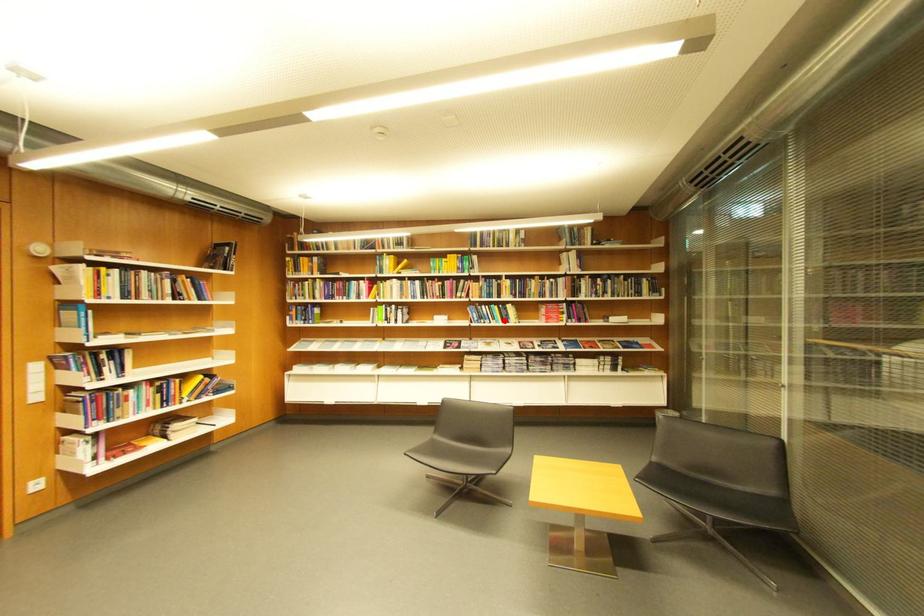
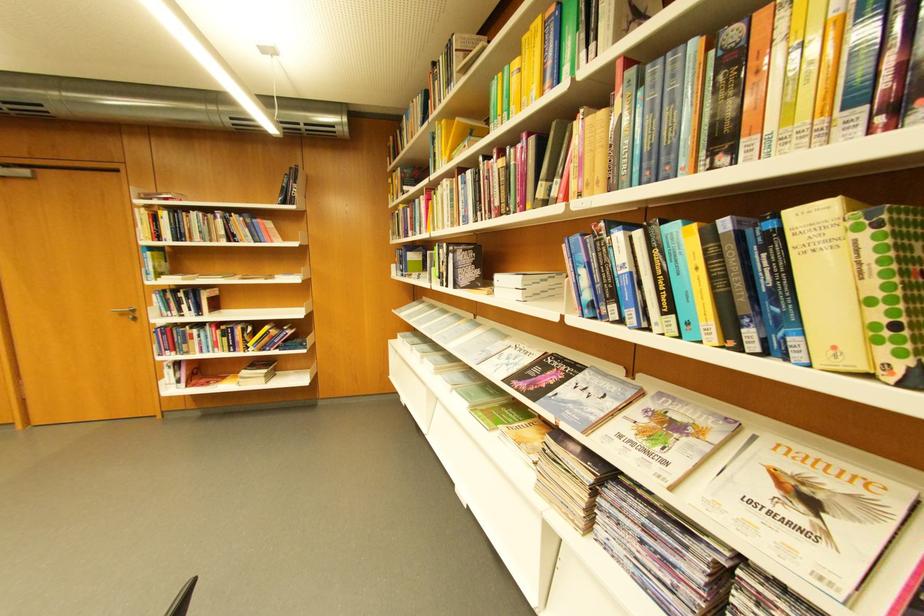
In the second image, find the point that corresponds to the highlighted location in the first image.

(681, 310)